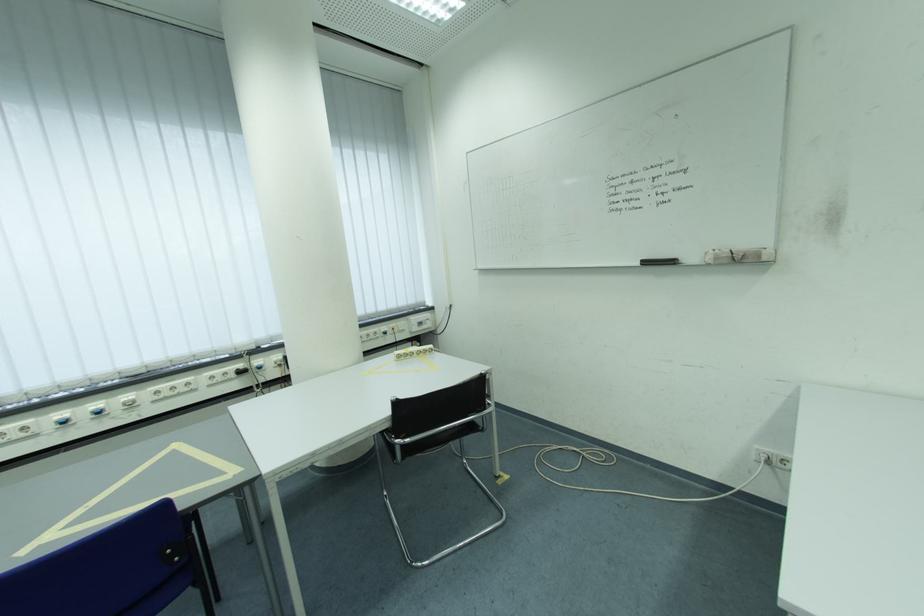
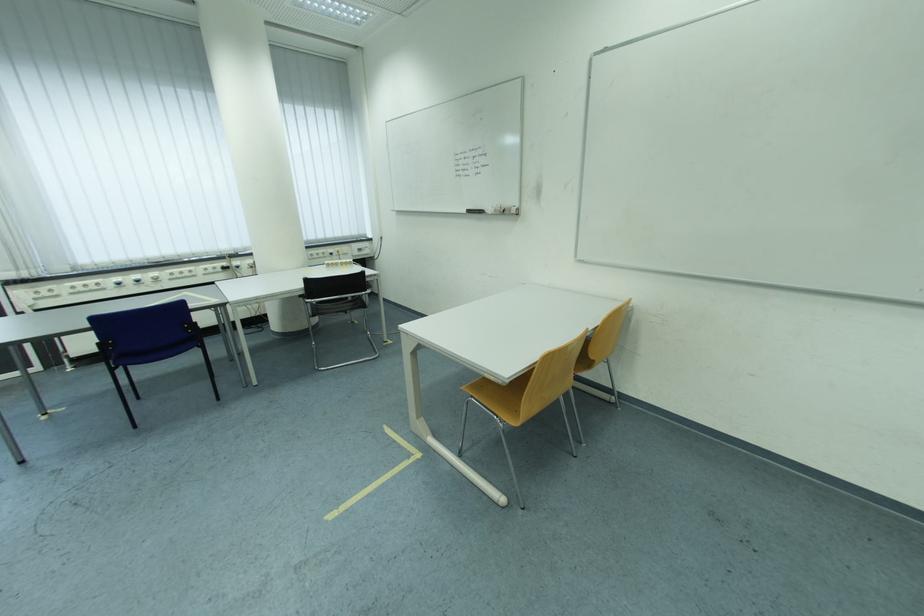
The point at (650,264) is marked in the first image. Where is the corresponding point in the second image?

(476, 213)